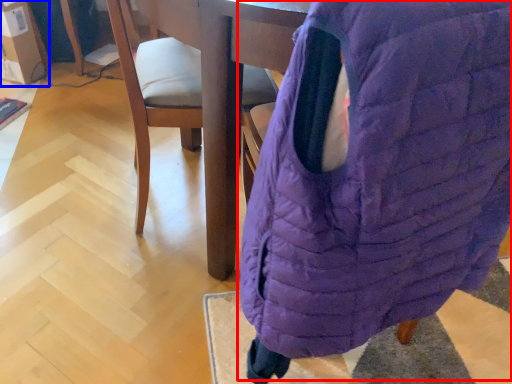
Question: Which object appears farthest to the camera in this image, bean bag chair (highlighted by a red box) or cardboard box (highlighted by a blue box)?

Choices:
 (A) bean bag chair
 (B) cardboard box

Answer: (B)